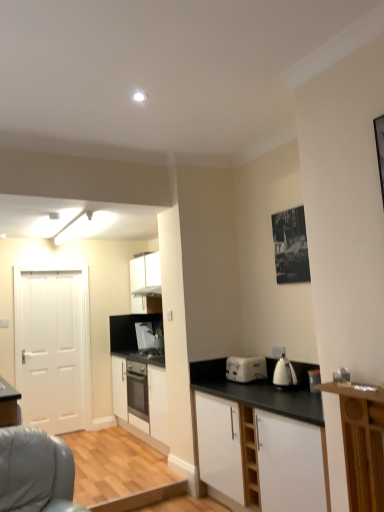
Question: Does white matte cabinet at center, which is counted as the first cabinetry, starting from the back, turn towards black paper poster at upper right?

Choices:
 (A) no
 (B) yes

Answer: (A)

Question: Is white matte cabinet at center, acting as the 3th cabinetry starting from the front, in contact with black paper poster at upper right?

Choices:
 (A) yes
 (B) no

Answer: (B)

Question: Is white matte cabinet at center, acting as the 3th cabinetry starting from the front, in front of black paper poster at upper right?

Choices:
 (A) yes
 (B) no

Answer: (B)

Question: From a real-world perspective, is white matte cabinet at center, acting as the 3th cabinetry starting from the front, on black paper poster at upper right?

Choices:
 (A) yes
 (B) no

Answer: (B)

Question: Considering the relative positions of white matte cabinet at center, acting as the 3th cabinetry starting from the front, and black paper poster at upper right in the image provided, is white matte cabinet at center, acting as the 3th cabinetry starting from the front, to the right of black paper poster at upper right from the viewer's perspective?

Choices:
 (A) no
 (B) yes

Answer: (A)

Question: From a real-world perspective, is white matte cabinet at center, acting as the 3th cabinetry starting from the front, positioned above or below black paper poster at upper right?

Choices:
 (A) above
 (B) below

Answer: (B)

Question: Is white matte cabinet at center, acting as the 3th cabinetry starting from the front, wider or thinner than black paper poster at upper right?

Choices:
 (A) wide
 (B) thin

Answer: (A)

Question: From the image's perspective, is white matte cabinet at center, acting as the 3th cabinetry starting from the front, positioned above or below black paper poster at upper right?

Choices:
 (A) above
 (B) below

Answer: (B)

Question: Choose the correct answer: Is white matte cabinet at center, which is counted as the first cabinetry, starting from the back, inside black paper poster at upper right or outside it?

Choices:
 (A) inside
 (B) outside

Answer: (B)

Question: Is white matte cabinet at lower right, marked as the 1th cabinetry in a front-to-back arrangement, in front of or behind white matte door at left in the image?

Choices:
 (A) front
 (B) behind

Answer: (A)

Question: From the image's perspective, is white matte cabinet at lower right, the third cabinetry in the back-to-front sequence, positioned above or below white matte door at left?

Choices:
 (A) below
 (B) above

Answer: (A)

Question: In terms of size, does white matte cabinet at lower right, marked as the 1th cabinetry in a front-to-back arrangement, appear bigger or smaller than white matte door at left?

Choices:
 (A) small
 (B) big

Answer: (B)

Question: Considering the positions of white matte cabinet at lower right, marked as the 1th cabinetry in a front-to-back arrangement, and white matte door at left in the image, is white matte cabinet at lower right, marked as the 1th cabinetry in a front-to-back arrangement, taller or shorter than white matte door at left?

Choices:
 (A) tall
 (B) short

Answer: (B)

Question: Considering the positions of white glossy electric kettle at right, which is counted as the first kitchen appliance, starting from the front, and white matte cabinet at center, acting as the 3th cabinetry starting from the front, in the image, is white glossy electric kettle at right, which is counted as the first kitchen appliance, starting from the front, wider or thinner than white matte cabinet at center, acting as the 3th cabinetry starting from the front,?

Choices:
 (A) wide
 (B) thin

Answer: (B)

Question: Considering the positions of point (286, 382) and point (137, 420), is point (286, 382) closer or farther from the camera than point (137, 420)?

Choices:
 (A) closer
 (B) farther

Answer: (A)